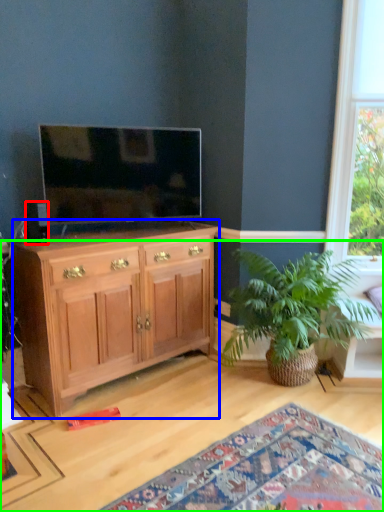
Question: Based on their relative distances, which object is nearer to loudspeaker (highlighted by a red box)? Choose from cabinetry (highlighted by a blue box) and desk (highlighted by a green box).

Choices:
 (A) cabinetry
 (B) desk

Answer: (A)